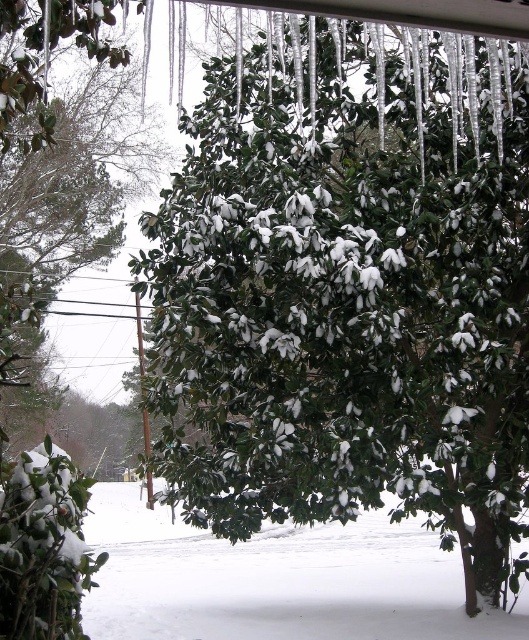
Question: Considering the relative positions of green matte tree at center and green matte leaves at center in the image provided, where is green matte tree at center located with respect to green matte leaves at center?

Choices:
 (A) left
 (B) right

Answer: (B)

Question: Can you confirm if green matte tree at center is thinner than green matte leaves at center?

Choices:
 (A) no
 (B) yes

Answer: (B)

Question: From the image, what is the correct spatial relationship of green matte tree at center in relation to green matte leaves at center?

Choices:
 (A) below
 (B) above

Answer: (A)

Question: Which object appears closest to the camera in this image?

Choices:
 (A) green matte leaves at center
 (B) green matte tree at center

Answer: (A)